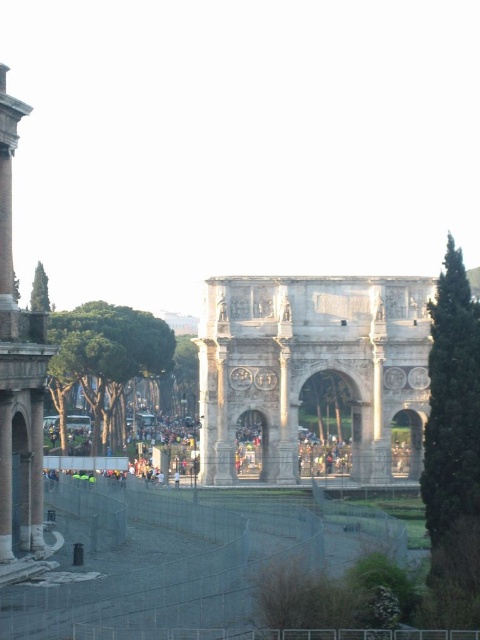
Which is behind, point (4, 198) or point (63, 458)?

Point (63, 458)

Who is more forward, (11, 282) or (103, 460)?

Point (11, 282) is more forward.

Image resolution: width=480 pixels, height=640 pixels. In order to click on smooth stone column at left in this screenshot , I will do `click(17, 371)`.